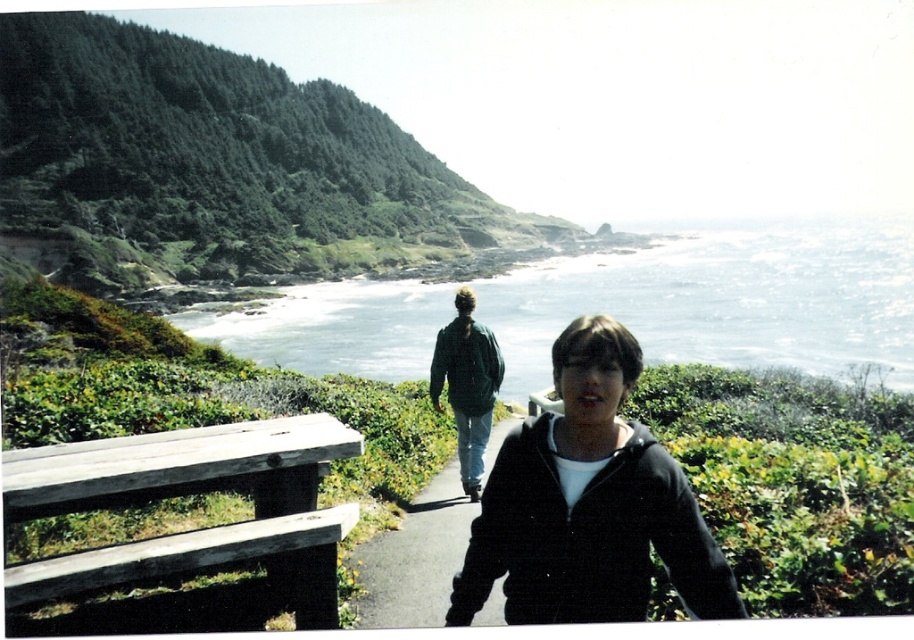
Is black matte jacket at center bigger than black asphalt path at center?

Indeed, black matte jacket at center has a larger size compared to black asphalt path at center.

Between point (666, 509) and point (429, 596), which one is positioned in front?

Point (666, 509)

Between point (607, 332) and point (364, 618), which one is positioned behind?

The point (364, 618) is more distant.

The width and height of the screenshot is (914, 640). What are the coordinates of `black matte jacket at center` in the screenshot? It's located at [588, 506].

Is clear blue water at center behind green matte jacket at center?

Yes, clear blue water at center is behind green matte jacket at center.

The image size is (914, 640). What do you see at coordinates (725, 300) in the screenshot? I see `clear blue water at center` at bounding box center [725, 300].

The height and width of the screenshot is (640, 914). What are the coordinates of `clear blue water at center` in the screenshot? It's located at (725, 300).

Who is more distant from viewer, (307, 371) or (527, 461)?

Point (307, 371)

Who is lower down, clear blue water at center or black matte jacket at center?

black matte jacket at center is lower down.

Who is more forward, (282, 336) or (558, 504)?

Point (558, 504) is more forward.

You are a GUI agent. You are given a task and a screenshot of the screen. Output one action in this format:
    pyautogui.click(x=<x>, y=<y>)
    Task: Click on the clear blue water at center
    The height and width of the screenshot is (640, 914).
    Given the screenshot: What is the action you would take?
    pyautogui.click(x=725, y=300)